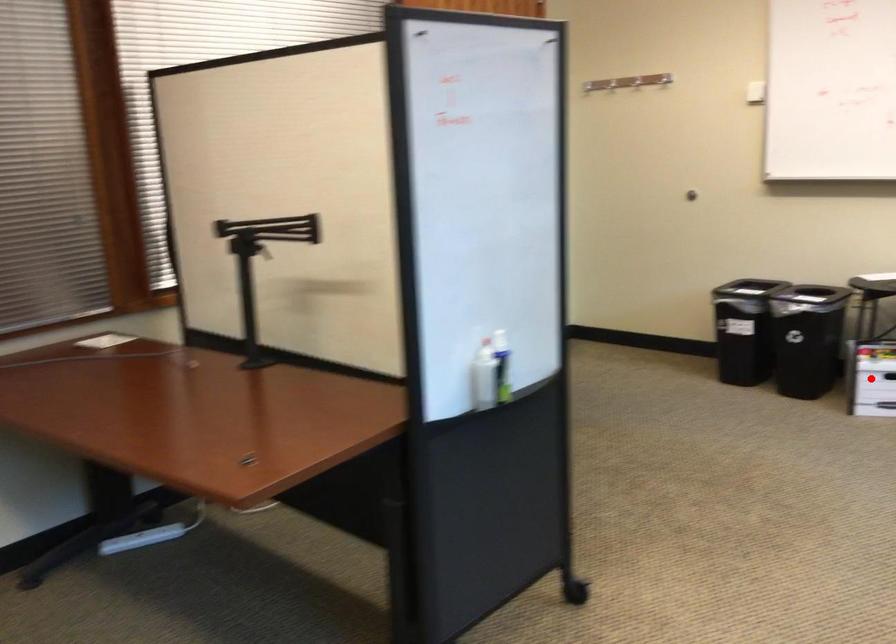
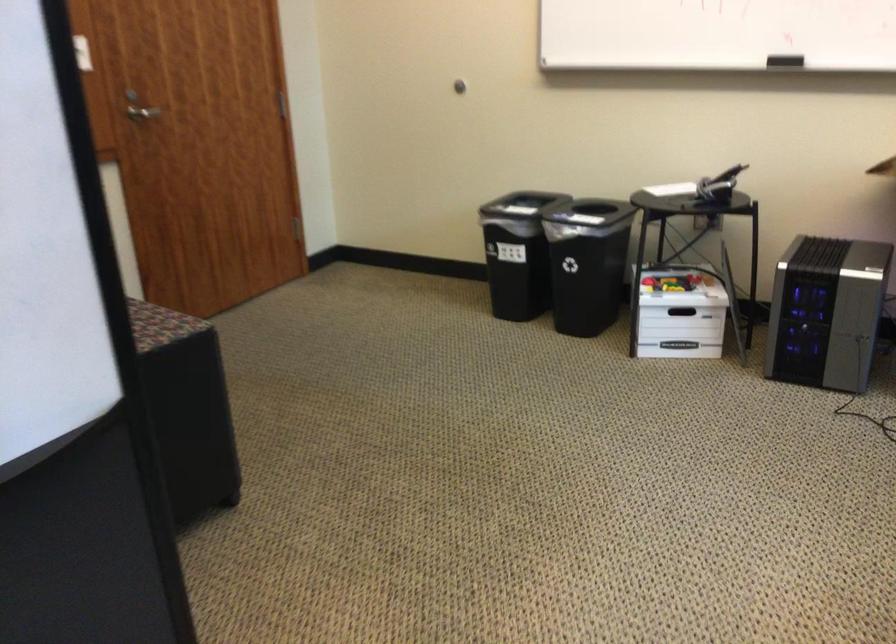
Question: I am providing you with two images of the same scene from different viewpoints. A red point is marked on the first image. At the location where the point appears in image 1, is it still visible in image 2?

Choices:
 (A) Yes
 (B) No

Answer: (B)